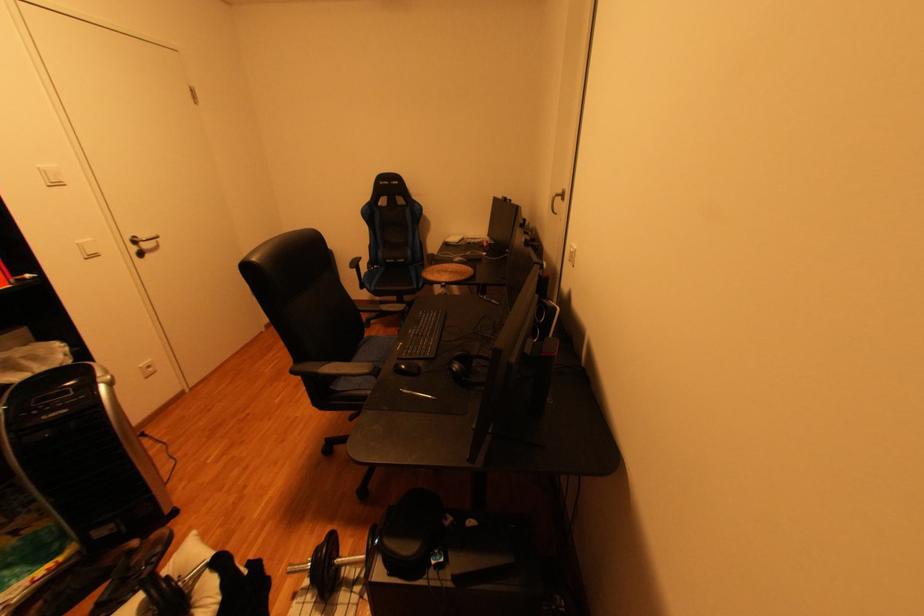
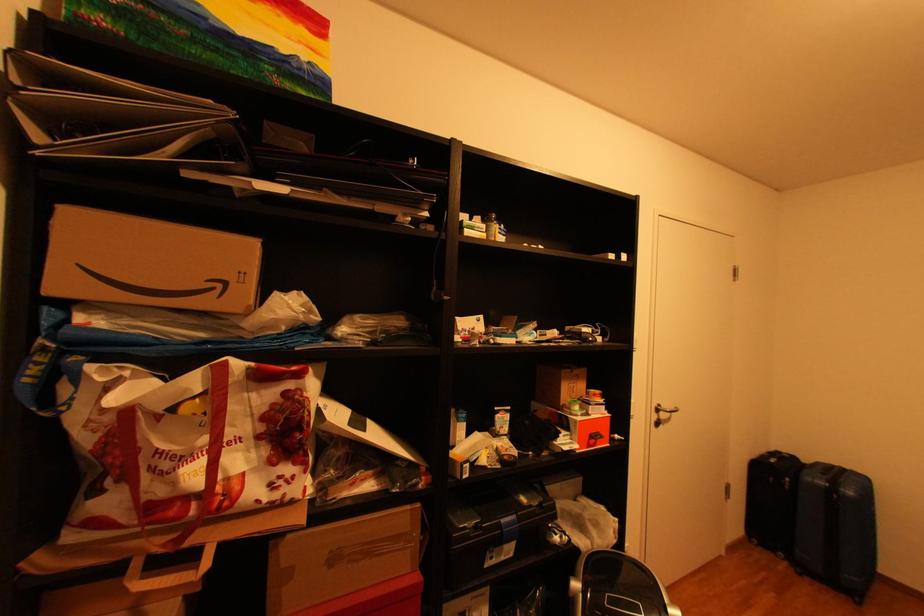
Question: Based on the continuous images, in which direction is the camera rotating? Reply with the corresponding letter.

Choices:
 (A) Left
 (B) Right
 (C) Up
 (D) Down

Answer: (A)